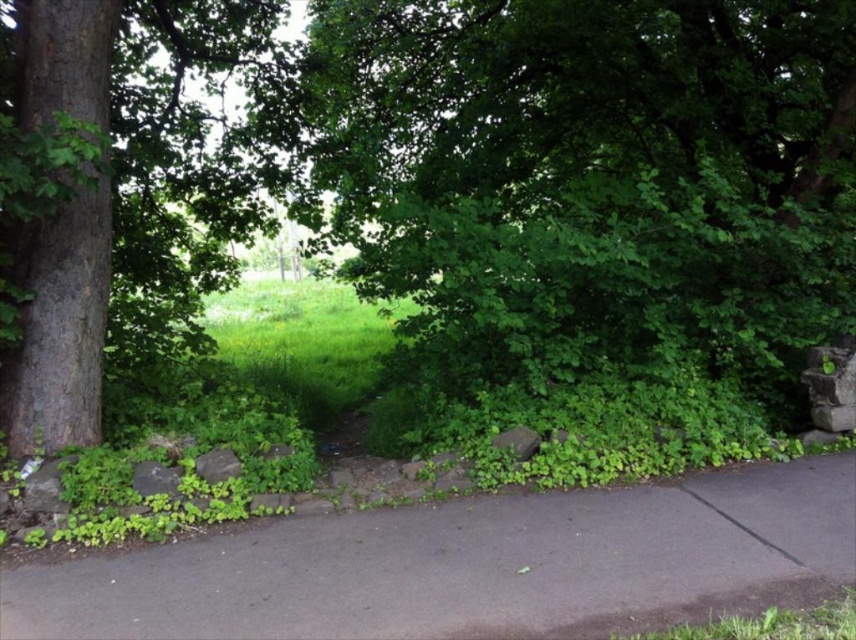
Does gray asphalt pavement at center appear on the right side of green leafy grass at lower right?

In fact, gray asphalt pavement at center is to the left of green leafy grass at lower right.

Identify the location of gray asphalt pavement at center. This screenshot has width=856, height=640. (467, 564).

Locate an element on the screen. gray asphalt pavement at center is located at coordinates (467, 564).

Consider the image. Does gray asphalt pavement at center have a lesser height compared to smooth brown tree trunk at left?

Yes, gray asphalt pavement at center is shorter than smooth brown tree trunk at left.

Does gray asphalt pavement at center have a greater width compared to smooth brown tree trunk at left?

Yes.

Does point (524, 595) lie behind point (158, 38)?

No, (524, 595) is in front of (158, 38).

Find the location of a particular element. gray asphalt pavement at center is located at coordinates (467, 564).

Is green leafy tree at center positioned at the back of green leafy grass at lower right?

That is True.

Consider the image. Does green leafy tree at center have a larger size compared to green leafy grass at lower right?

Correct, green leafy tree at center is larger in size than green leafy grass at lower right.

Who is more forward, (241, 67) or (640, 634)?

Point (640, 634) is more forward.

Find the location of a particular element. green leafy tree at center is located at coordinates (444, 173).